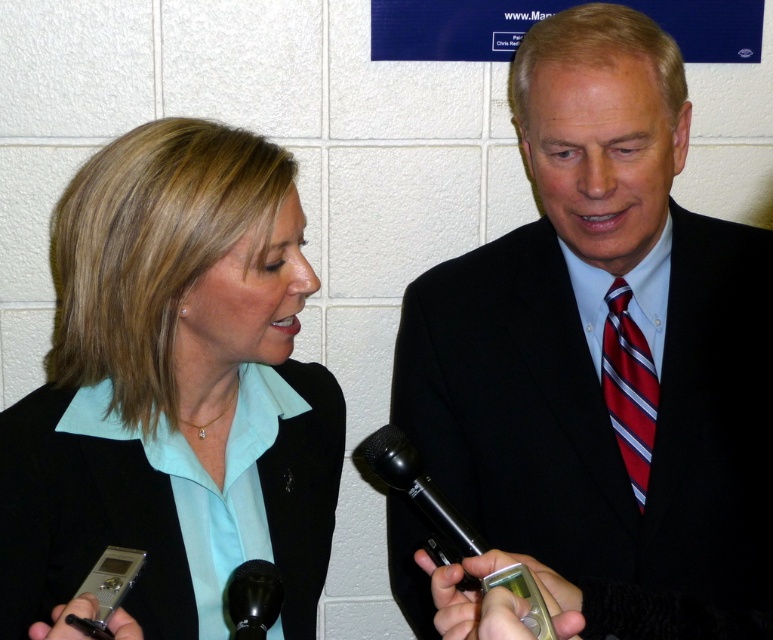
You are a photographer setting up for a photo shoot in this interview scene. You need to place a small prop between the two points labeled point [635,387] and point [273,592]. Which point should the prop be closer to if you want it to appear larger in the photo?

The prop should be placed closer to point [273,592] because it is closer to the camera than point [635,387], making objects placed there appear larger in the photo.